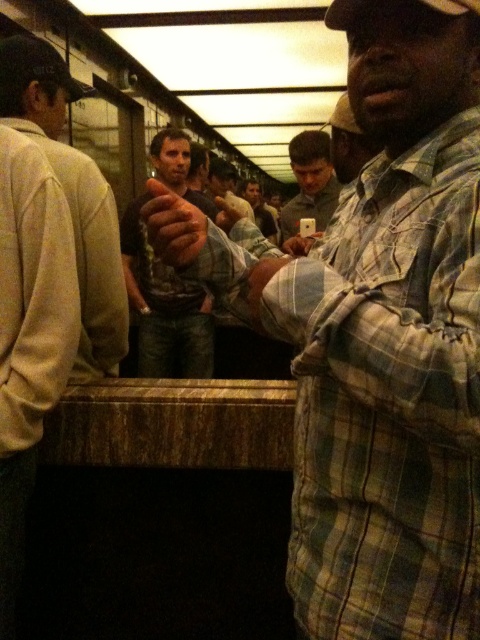
You are a photographer trying to capture a candid shot of both the plaid shirt at center and the light beige sweater at left. Since you want to frame them together, which one should you position on the left side of your camera frame?

The light beige sweater at left should be positioned on the left side of your camera frame because the plaid shirt at center is already on its right side relative to the light beige sweater at left.